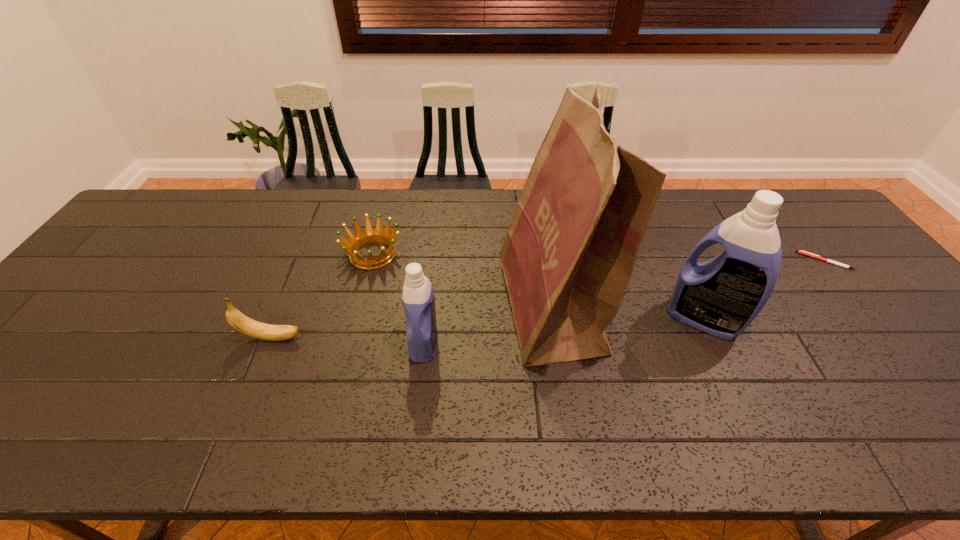
Find the location of a particular element. The width and height of the screenshot is (960, 540). blank area in the image that satisfies the following two spatial constraints: 1. on the front-facing side of the fourth object from left to right; 2. on the front side of the shorter detergent is located at coordinates (556, 342).